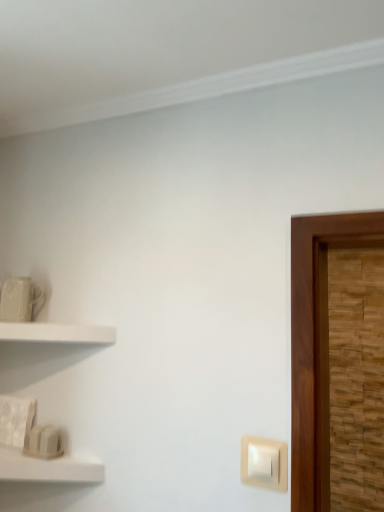
Question: Based on their positions, is white matte shelf at left, which appears as the first shelf when viewed from the top, located to the left or right of beige plastic light switch at lower right?

Choices:
 (A) right
 (B) left

Answer: (B)

Question: Looking at their shapes, would you say white matte shelf at left, which appears as the first shelf when viewed from the top, is wider or thinner than beige plastic light switch at lower right?

Choices:
 (A) thin
 (B) wide

Answer: (B)

Question: Which of these objects is positioned closest to the beige plastic light switch at lower right?

Choices:
 (A) white matte shelf at lower left, which ranks as the 1th shelf in bottom-to-top order
 (B) white matte shelf at left, which appears as the first shelf when viewed from the top

Answer: (A)

Question: Estimate the real-world distances between objects in this image. Which object is closer to the white matte shelf at lower left, which ranks as the 1th shelf in bottom-to-top order?

Choices:
 (A) white matte shelf at left, which is the second shelf in bottom-to-top order
 (B) beige plastic light switch at lower right

Answer: (A)